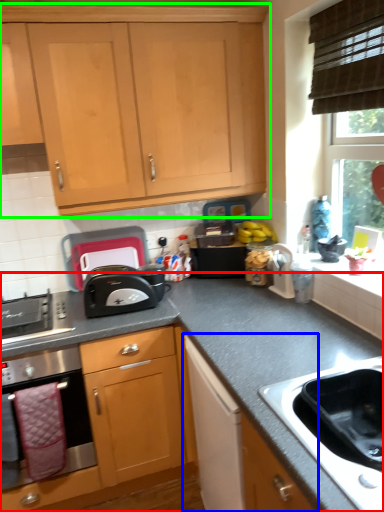
Question: Which is nearer to the countertop (highlighted by a red box)? cabinetry (highlighted by a blue box) or cabinetry (highlighted by a green box).

Choices:
 (A) cabinetry
 (B) cabinetry

Answer: (A)